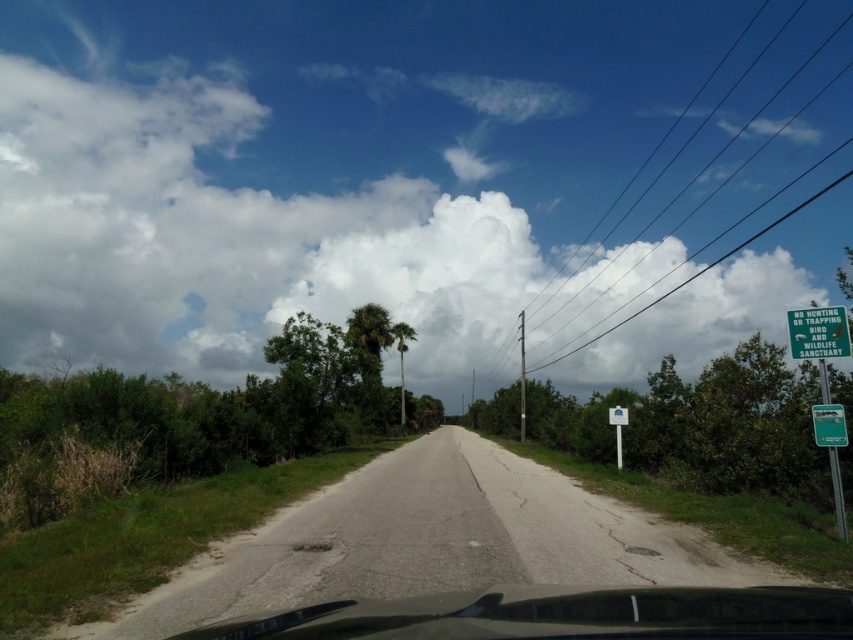
Is point (809, 340) closer to viewer compared to point (824, 435)?

No.

Who is taller, green plastic sign at upper right or green plastic sign at right?

green plastic sign at upper right is taller.

Does point (840, 324) lie behind point (825, 429)?

That is True.

The image size is (853, 640). In order to click on green plastic sign at upper right in this screenshot , I will do `click(817, 332)`.

Which is below, black glossy car at center or green leafy palm tree at center?

green leafy palm tree at center is below.

Where is `black glossy car at center`? The image size is (853, 640). black glossy car at center is located at coordinates (563, 616).

Describe the element at coordinates (817, 332) in the screenshot. I see `green plastic sign at upper right` at that location.

Where is `green plastic sign at upper right`? green plastic sign at upper right is located at coordinates (817, 332).